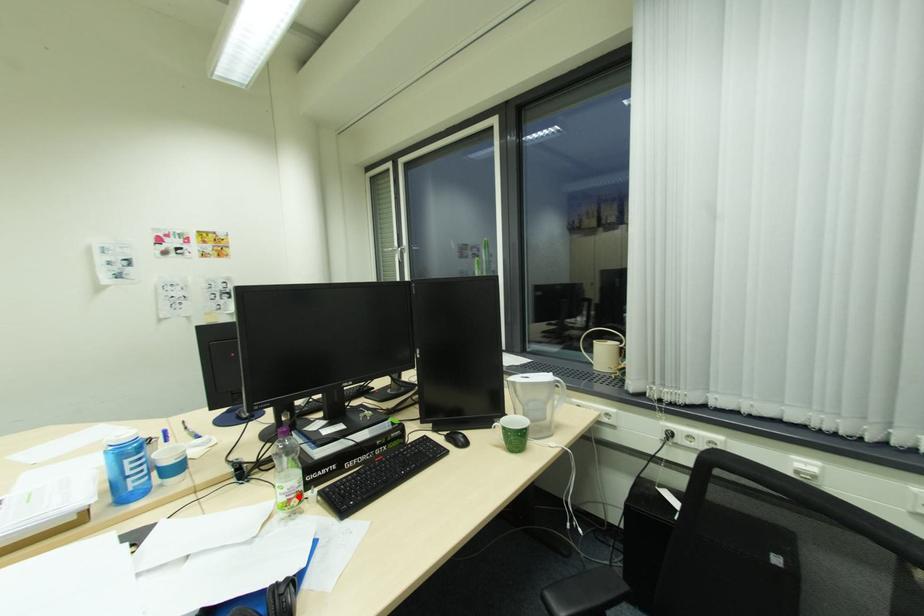
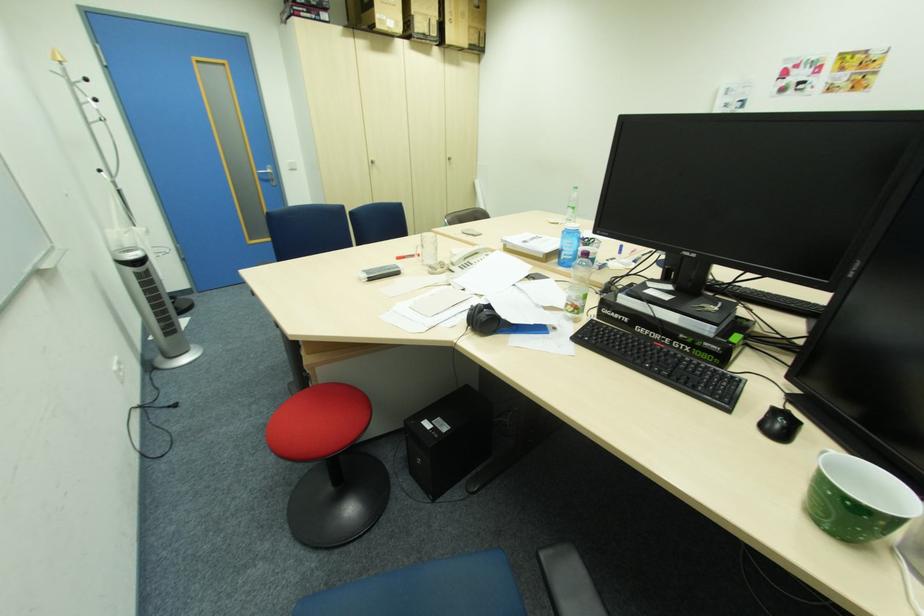
Find the pixel in the second image that matches the highlighted location in the first image.

(575, 304)